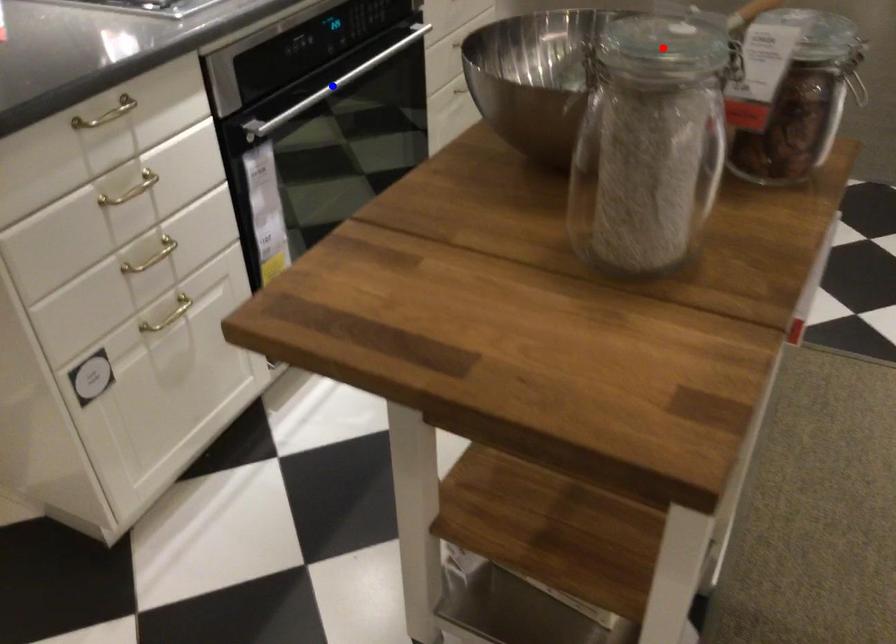
Question: Which of the two points in the image is closer to the camera?

Choices:
 (A) Blue point is closer.
 (B) Red point is closer.

Answer: (B)